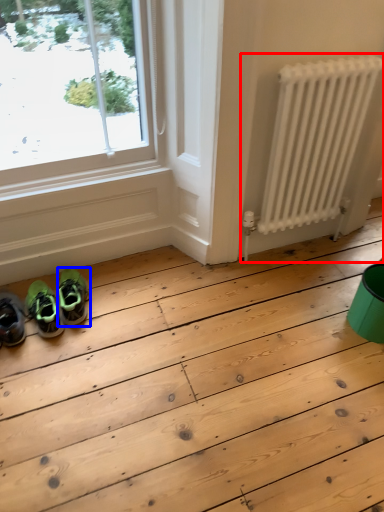
Question: Which object is further to the camera taking this photo, radiator (highlighted by a red box) or footwear (highlighted by a blue box)?

Choices:
 (A) radiator
 (B) footwear

Answer: (B)